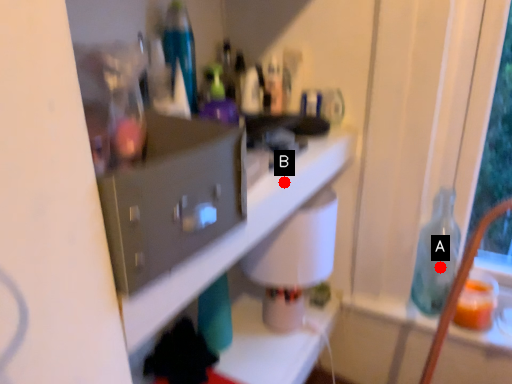
Question: Two points are circled on the image, labeled by A and B beside each circle. Which point is closer to the camera?

Choices:
 (A) A is closer
 (B) B is closer

Answer: (B)